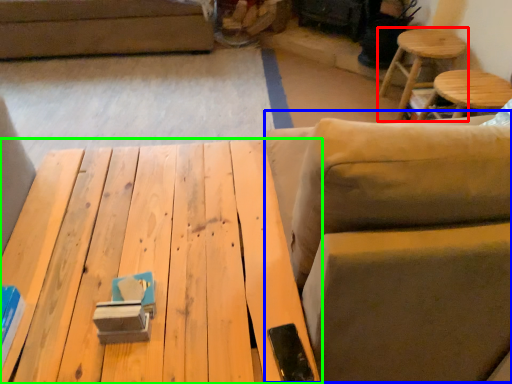
Question: Considering the real-world distances, which object is farthest from stool (highlighted by a red box)? swivel chair (highlighted by a blue box) or table (highlighted by a green box)?

Choices:
 (A) swivel chair
 (B) table

Answer: (B)